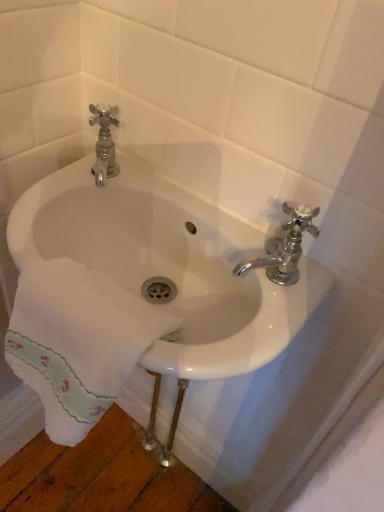
In order to face white ceramic sink at center, should I rotate leftwards or rightwards?

To align with it, rotate left about 6.127°.

What is the approximate width of white embroidered towel at lower left?

white embroidered towel at lower left is 5.72 inches wide.

At what (x,y) coordinates should I click in order to perform the action: click on white ceramic sink at center. Please return your answer as a coordinate pair (x, y). The image size is (384, 512). Looking at the image, I should click on (170, 263).

Considering the positions of objects chrome metallic faucet at upper right and white embroidered towel at lower left in the image provided, who is in front, chrome metallic faucet at upper right or white embroidered towel at lower left?

white embroidered towel at lower left is closer to the camera.

Can you confirm if chrome metallic faucet at upper right is bigger than white embroidered towel at lower left?

Actually, chrome metallic faucet at upper right might be smaller than white embroidered towel at lower left.

Is chrome metallic faucet at upper right positioned with its back to white embroidered towel at lower left?

chrome metallic faucet at upper right is not turned away from white embroidered towel at lower left.

From the image's perspective, is chrome metallic faucet at upper right located beneath white embroidered towel at lower left?

No, from the image's perspective, chrome metallic faucet at upper right is not below white embroidered towel at lower left.

From a real-world perspective, relative to white ceramic sink at center, is white embroidered towel at lower left vertically above or below?

white embroidered towel at lower left is below white ceramic sink at center.

Would you say white embroidered towel at lower left contains white ceramic sink at center?

No, white ceramic sink at center is not a part of white embroidered towel at lower left.

Considering the sizes of objects white embroidered towel at lower left and white ceramic sink at center in the image provided, who is bigger, white embroidered towel at lower left or white ceramic sink at center?

white ceramic sink at center is bigger.

Locate an element on the screen. The image size is (384, 512). sink behind the white embroidered towel at lower left is located at coordinates (170, 263).

Is chrome metallic faucet at upper right directly adjacent to white ceramic sink at center?

chrome metallic faucet at upper right and white ceramic sink at center are clearly separated.

Is chrome metallic faucet at upper right at the right side of white ceramic sink at center?

Yes.

Find the location of `sink on the left of the chrome metallic faucet at upper right`. sink on the left of the chrome metallic faucet at upper right is located at coordinates (170, 263).

From a real-world perspective, is white ceramic sink at center over chrome metallic faucet at upper right?

No, from a real-world perspective, white ceramic sink at center is not above chrome metallic faucet at upper right.

Are white ceramic sink at center and chrome metallic faucet at upper right making contact?

white ceramic sink at center and chrome metallic faucet at upper right are not in contact.

Is white ceramic sink at center to the left of chrome metallic faucet at upper right from the viewer's perspective?

Yes.

What's the angular difference between white ceramic sink at center and white embroidered towel at lower left's facing directions?

0.000667 degrees.

Choose the correct answer: Is white ceramic sink at center inside white embroidered towel at lower left or outside it?

The correct answer is: outside.

Image resolution: width=384 pixels, height=512 pixels. Identify the location of bath towel beneath the white ceramic sink at center (from a real-world perspective). (77, 342).

Is white ceramic sink at center to the left or to the right of white embroidered towel at lower left in the image?

In the image, white ceramic sink at center appears on the right side of white embroidered towel at lower left.

Does white embroidered towel at lower left have a larger size compared to chrome metallic faucet at upper right?

A: Yes.

Is point (19, 309) positioned in front of point (270, 258)?

Yes, it is in front of point (270, 258).

Which object is thinner, white embroidered towel at lower left or chrome metallic faucet at upper right?

chrome metallic faucet at upper right.

Considering the sizes of objects white embroidered towel at lower left and chrome metallic faucet at upper right in the image provided, who is taller, white embroidered towel at lower left or chrome metallic faucet at upper right?

white embroidered towel at lower left is taller.

In order to click on tap behind the white embroidered towel at lower left in this screenshot , I will do `click(284, 246)`.

The height and width of the screenshot is (512, 384). I want to click on sink on the right of white embroidered towel at lower left, so click(170, 263).

When comparing their distances from chrome metallic faucet at upper right, does white ceramic sink at center or white embroidered towel at lower left seem closer?

Based on the image, white ceramic sink at center appears to be nearer to chrome metallic faucet at upper right.

From the image, which object appears to be nearer to chrome metallic faucet at upper right, white embroidered towel at lower left or white ceramic sink at center?

The object closer to chrome metallic faucet at upper right is white ceramic sink at center.

When comparing their distances from white ceramic sink at center, does white embroidered towel at lower left or chrome metallic faucet at upper right seem further?

chrome metallic faucet at upper right lies further to white ceramic sink at center than the other object.

When comparing their distances from white embroidered towel at lower left, does chrome metallic faucet at upper right or white ceramic sink at center seem closer?

Among the two, white ceramic sink at center is located nearer to white embroidered towel at lower left.

From the image, which object appears to be nearer to white embroidered towel at lower left, white ceramic sink at center or chrome metallic faucet at upper right?

white ceramic sink at center is positioned closer to the anchor white embroidered towel at lower left.

Estimate the real-world distances between objects in this image. Which object is closer to white ceramic sink at center, chrome metallic faucet at upper right or white embroidered towel at lower left?

white embroidered towel at lower left.

Image resolution: width=384 pixels, height=512 pixels. I want to click on sink between white embroidered towel at lower left and chrome metallic faucet at upper right in the horizontal direction, so click(170, 263).